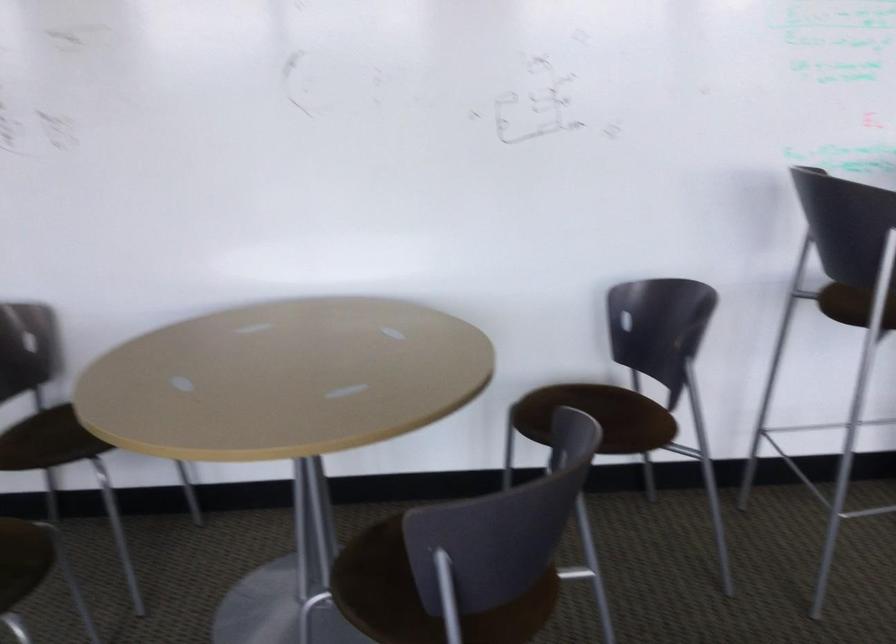
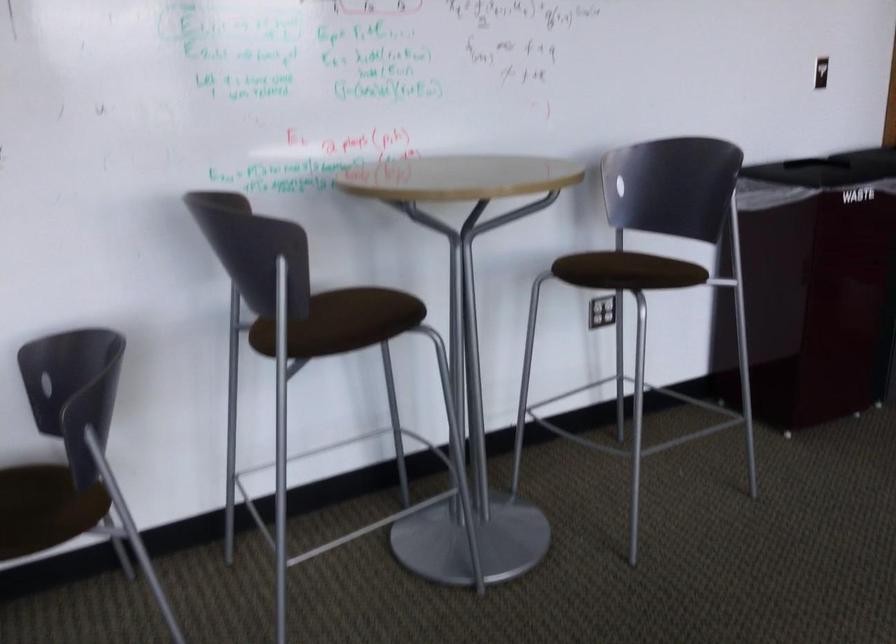
Question: How did the camera likely rotate?

Choices:
 (A) Left
 (B) Right
 (C) Up
 (D) Down

Answer: (B)